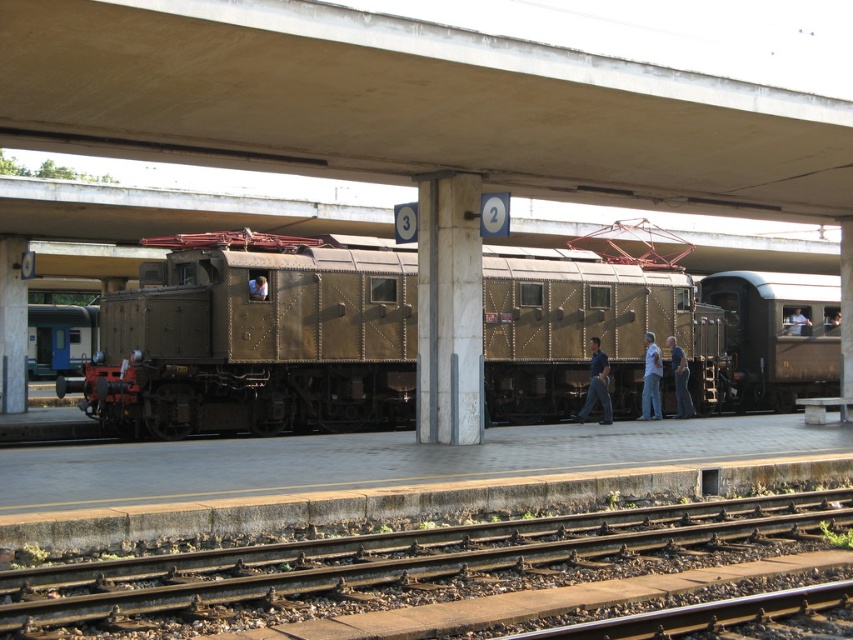
You are standing at the platform edge near the yellow tactile paving. You want to walk to the smooth metal tracks at lower center located at point (396, 561). How many steps should you take to reach them safely?

The smooth metal tracks at lower center are located at point (396, 561), so you should take 10 steps forward from the platform edge to reach them safely.

You are standing at the railway station and want to locate two specific points marked in the image. The first point is at coordinates point (151, 611), and the second is at point (788, 332). Which of these two points is nearer to your current position?

Point (151, 611) is closer to the viewer than point (788, 332), so the first point is nearer to your current position.